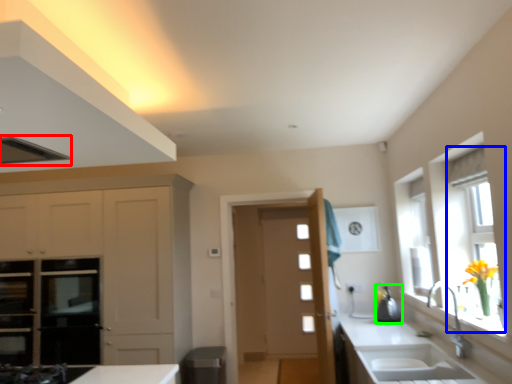
Question: Which is nearer to the exhaust hood (highlighted by a red box)? window (highlighted by a blue box) or appliance (highlighted by a green box).

Choices:
 (A) window
 (B) appliance

Answer: (A)